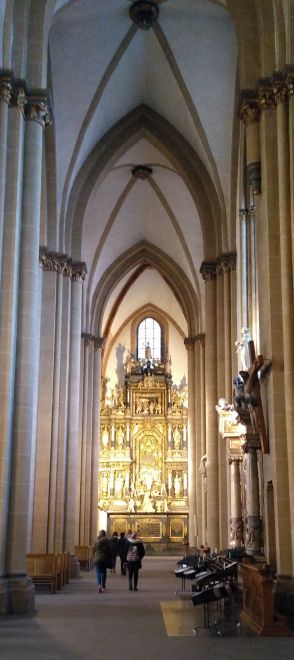
Locate an element on the screen. This screenshot has height=660, width=294. lighted objects is located at coordinates (146, 478).